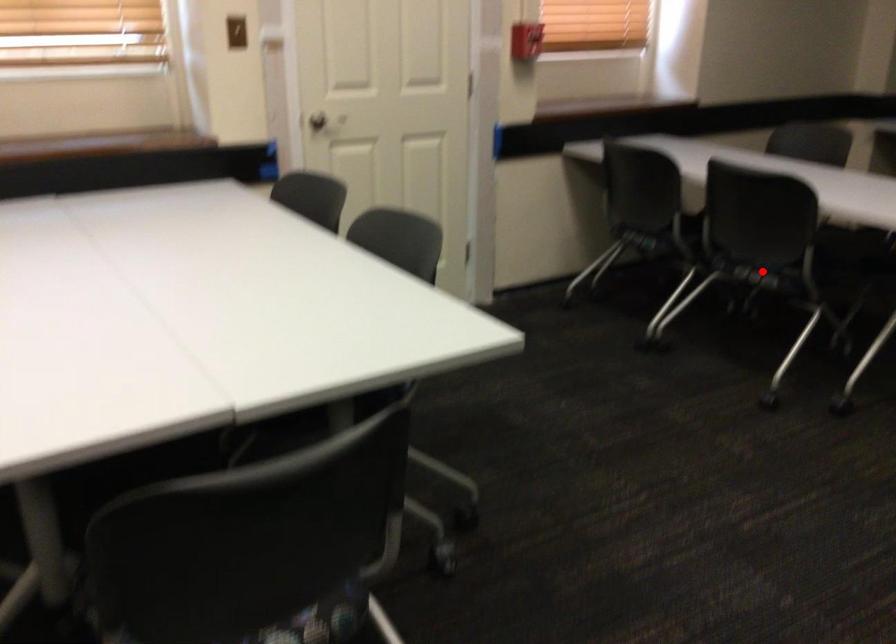
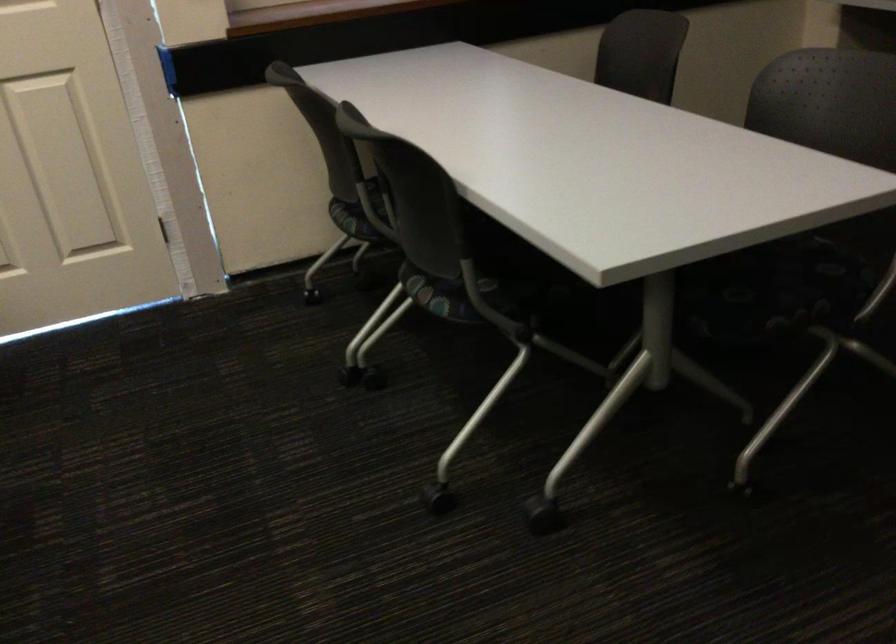
Question: I am providing you with two images of the same scene from different viewpoints. Image1 has a red point marked. In image2, the corresponding 3D location appears at what relative position? Reply with the corresponding letter.

Choices:
 (A) Closer
 (B) Farther

Answer: (A)